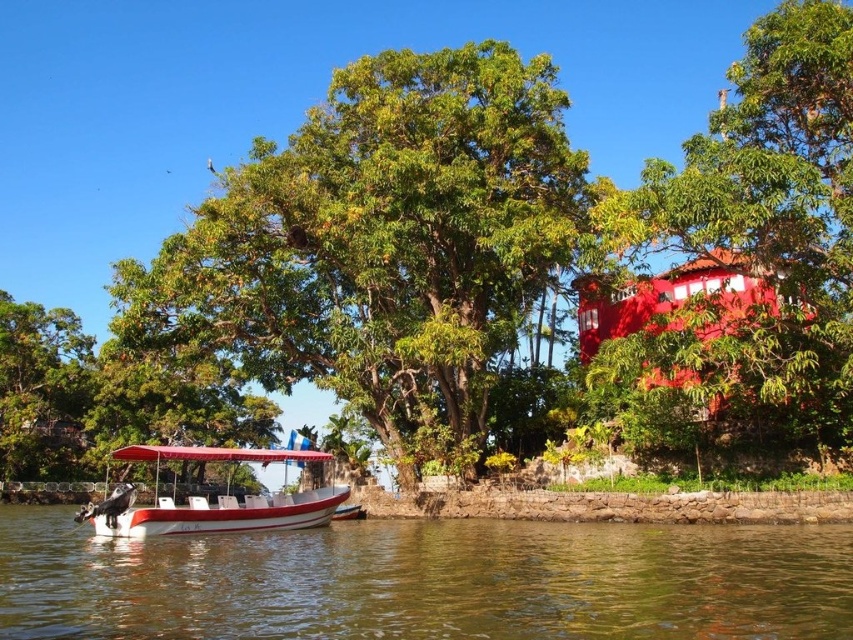
Is green leafy tree at upper right smaller than white glossy boat at lower left?

Yes.

Looking at this image, can you confirm if green leafy tree at upper right is wider than white glossy boat at lower left?

No, green leafy tree at upper right is not wider than white glossy boat at lower left.

I want to click on green leafy tree at upper right, so click(x=764, y=225).

In the scene shown: Can you confirm if greenish-brown water at lower center is smaller than white glossy boat at lower left?

Yes.

Does greenish-brown water at lower center have a lesser height compared to white glossy boat at lower left?

Yes, greenish-brown water at lower center is shorter than white glossy boat at lower left.

Where is `greenish-brown water at lower center`? greenish-brown water at lower center is located at coordinates (426, 580).

Can you confirm if green leafy tree at center is bigger than greenish-brown water at lower center?

Indeed, green leafy tree at center has a larger size compared to greenish-brown water at lower center.

Does green leafy tree at center appear on the left side of greenish-brown water at lower center?

In fact, green leafy tree at center is to the right of greenish-brown water at lower center.

Is point (407, 349) positioned after point (627, 566)?

Yes, point (407, 349) is farther from viewer.

Find the location of `green leafy tree at center`. green leafy tree at center is located at coordinates pos(381,244).